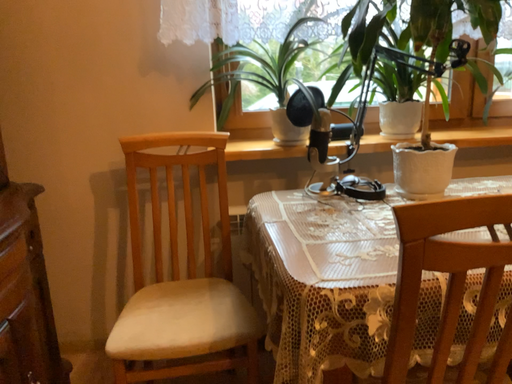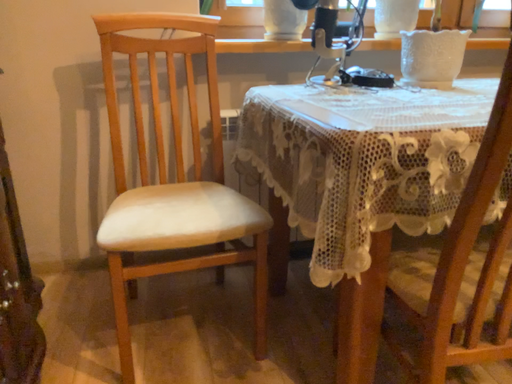
Question: Which way did the camera rotate in the video?

Choices:
 (A) rotated left
 (B) rotated right

Answer: (B)